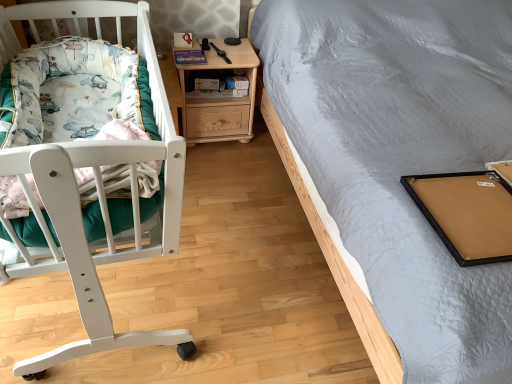
In order to face fluffy cotton blanket at left, should I rotate leftwards or rightwards?

To face it directly, rotate left by 23.156 degrees.

Measure the distance between fluffy cotton blanket at left and camera.

36.50 inches.

What do you see at coordinates (13, 198) in the screenshot? I see `fluffy cotton blanket at left` at bounding box center [13, 198].

This screenshot has width=512, height=384. What are the coordinates of `fluffy cotton blanket at left` in the screenshot? It's located at (13, 198).

You are a GUI agent. You are given a task and a screenshot of the screen. Output one action in this format:
    pyautogui.click(x=<x>, y=<y>)
    Task: Click on the light woodmaterial/texturenightstand at center
    
    Given the screenshot: What is the action you would take?
    pyautogui.click(x=221, y=100)

What do you see at coordinates (221, 100) in the screenshot? I see `light woodmaterial/texturenightstand at center` at bounding box center [221, 100].

Find the location of a particular element. The width and height of the screenshot is (512, 384). fluffy cotton blanket at left is located at coordinates (13, 198).

Considering the positions of objects light woodmaterial/texturenightstand at center and fluffy cotton blanket at left in the image provided, who is more to the right, light woodmaterial/texturenightstand at center or fluffy cotton blanket at left?

From the viewer's perspective, light woodmaterial/texturenightstand at center appears more on the right side.

Which is behind, light woodmaterial/texturenightstand at center or fluffy cotton blanket at left?

light woodmaterial/texturenightstand at center is behind.

Which point is more distant from viewer, (220,139) or (86,182)?

Positioned behind is point (220,139).

From the image's perspective, does light woodmaterial/texturenightstand at center appear lower than fluffy cotton blanket at left?

Incorrect, from the image's perspective, light woodmaterial/texturenightstand at center is higher than fluffy cotton blanket at left.

From a real-world perspective, is light woodmaterial/texturenightstand at center physically located above or below fluffy cotton blanket at left?

In terms of real-world spatial position, light woodmaterial/texturenightstand at center is below fluffy cotton blanket at left.

Between light woodmaterial/texturenightstand at center and fluffy cotton blanket at left, which one has smaller width?

light woodmaterial/texturenightstand at center is thinner.

Which of these two, light woodmaterial/texturenightstand at center or fluffy cotton blanket at left, stands taller?

light woodmaterial/texturenightstand at center is taller.

Can you confirm if light woodmaterial/texturenightstand at center is bigger than fluffy cotton blanket at left?

Yes.

Is light woodmaterial/texturenightstand at center inside or outside of fluffy cotton blanket at left?

light woodmaterial/texturenightstand at center cannot be found inside fluffy cotton blanket at left.

Looking at this image, is light woodmaterial/texturenightstand at center positioned far away from fluffy cotton blanket at left?

Indeed, light woodmaterial/texturenightstand at center is not near fluffy cotton blanket at left.

Is light woodmaterial/texturenightstand at center facing towards fluffy cotton blanket at left?

No, light woodmaterial/texturenightstand at center is not facing towards fluffy cotton blanket at left.

What's the angular difference between light woodmaterial/texturenightstand at center and fluffy cotton blanket at left's facing directions?

They differ by 87.6 degrees in their facing directions.

Where is `nightstand directly beneath the fluffy cotton blanket at left (from a real-world perspective)`? nightstand directly beneath the fluffy cotton blanket at left (from a real-world perspective) is located at coordinates (221, 100).

Considering the positions of objects fluffy cotton blanket at left and light woodmaterial/texturenightstand at center in the image provided, who is more to the left, fluffy cotton blanket at left or light woodmaterial/texturenightstand at center?

Positioned to the left is fluffy cotton blanket at left.

Considering the relative positions of fluffy cotton blanket at left and light woodmaterial/texturenightstand at center in the image provided, is fluffy cotton blanket at left behind light woodmaterial/texturenightstand at center?

No, it is not.

Is point (13, 189) positioned after point (186, 122)?

No, it is in front of (186, 122).

From the image's perspective, between fluffy cotton blanket at left and light woodmaterial/texturenightstand at center, who is located below?

fluffy cotton blanket at left.

From a real-world perspective, is fluffy cotton blanket at left above or below light woodmaterial/texturenightstand at center?

In terms of real-world spatial position, fluffy cotton blanket at left is above light woodmaterial/texturenightstand at center.

Between fluffy cotton blanket at left and light woodmaterial/texturenightstand at center, which one has smaller width?

light woodmaterial/texturenightstand at center.

Considering the relative sizes of fluffy cotton blanket at left and light woodmaterial/texturenightstand at center in the image provided, is fluffy cotton blanket at left taller than light woodmaterial/texturenightstand at center?

Incorrect, the height of fluffy cotton blanket at left is not larger of that of light woodmaterial/texturenightstand at center.

Between fluffy cotton blanket at left and light woodmaterial/texturenightstand at center, which one has smaller size?

With smaller size is fluffy cotton blanket at left.

Would you say light woodmaterial/texturenightstand at center is part of fluffy cotton blanket at left's contents?

Actually, light woodmaterial/texturenightstand at center is outside fluffy cotton blanket at left.

Are fluffy cotton blanket at left and light woodmaterial/texturenightstand at center located far from each other?

fluffy cotton blanket at left is far away from light woodmaterial/texturenightstand at center.

Is fluffy cotton blanket at left positioned with its back to light woodmaterial/texturenightstand at center?

No, fluffy cotton blanket at left's orientation is not away from light woodmaterial/texturenightstand at center.

Measure the distance from fluffy cotton blanket at left to light woodmaterial/texturenightstand at center.

A distance of 3.66 feet exists between fluffy cotton blanket at left and light woodmaterial/texturenightstand at center.

Locate an element on the screen. The height and width of the screenshot is (384, 512). blanket on the left of light woodmaterial/texturenightstand at center is located at coordinates (13, 198).

The image size is (512, 384). I want to click on blanket in front of the light woodmaterial/texturenightstand at center, so click(x=13, y=198).

I want to click on blanket that appears below the light woodmaterial/texturenightstand at center (from the image's perspective), so click(x=13, y=198).